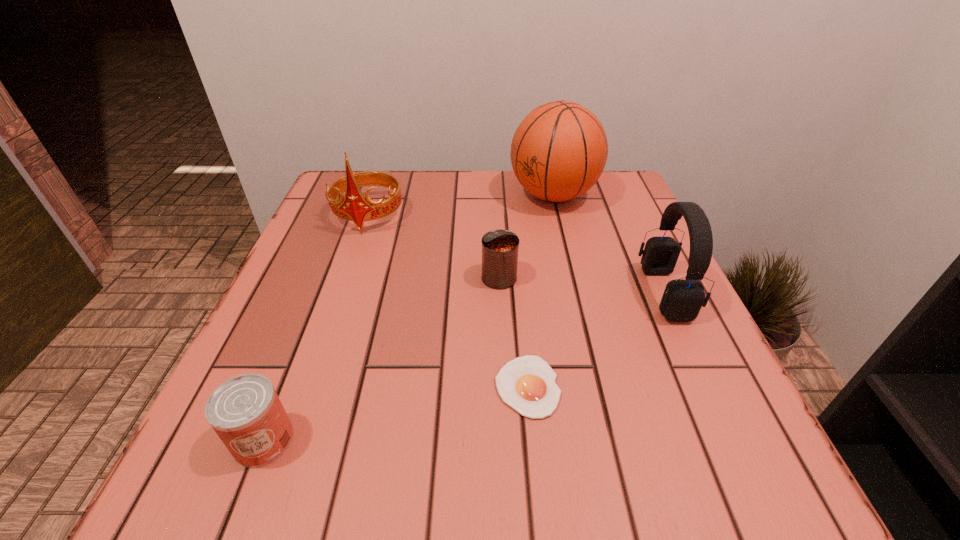
Image resolution: width=960 pixels, height=540 pixels. I want to click on blank space at the far left corner of the desktop, so click(x=322, y=202).

Locate an element on the screen. This screenshot has height=540, width=960. free space between the shortest object and the second shortest object is located at coordinates (396, 413).

The image size is (960, 540). I want to click on empty location between the basketball and the rightmost object, so click(x=609, y=244).

This screenshot has width=960, height=540. In order to click on free point between the second shortest object and the tiara in this screenshot , I will do `click(316, 328)`.

Image resolution: width=960 pixels, height=540 pixels. I want to click on free space between the left can and the farther can, so [381, 359].

Locate an element on the screen. This screenshot has width=960, height=540. vacant space that's between the headset and the basketball is located at coordinates (609, 244).

Where is `free point between the basketball and the farther can`? The image size is (960, 540). free point between the basketball and the farther can is located at coordinates (526, 237).

This screenshot has height=540, width=960. I want to click on empty location between the rightmost object and the basketball, so click(609, 244).

Locate an element on the screen. vacant space that's between the taller can and the fifth tallest object is located at coordinates (381, 359).

The height and width of the screenshot is (540, 960). I want to click on object that is the third closest one to the headset, so click(500, 248).